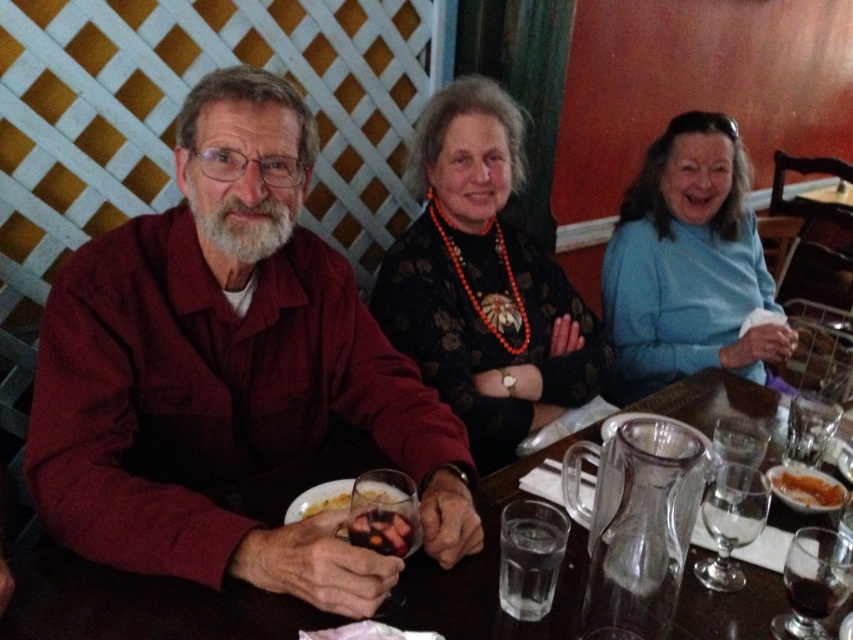
Is black floral dress at center below yellowish matte plate at lower center?

No, black floral dress at center is not below yellowish matte plate at lower center.

Who is positioned more to the left, black floral dress at center or yellowish matte plate at lower center?

Positioned to the left is yellowish matte plate at lower center.

Does point (490, 225) come behind point (320, 500)?

Yes, it is behind point (320, 500).

I want to click on black floral dress at center, so click(x=485, y=282).

Is clear glass pitcher at center behind blue soft sweater at upper right?

No.

Can you confirm if clear glass pitcher at center is shorter than blue soft sweater at upper right?

Correct, clear glass pitcher at center is not as tall as blue soft sweater at upper right.

Where is `clear glass pitcher at center`? The width and height of the screenshot is (853, 640). clear glass pitcher at center is located at coordinates (138, 604).

Find the location of a particular element. clear glass pitcher at center is located at coordinates (138, 604).

Is clear glass pitcher at center to the left of black floral dress at center from the viewer's perspective?

No, clear glass pitcher at center is not to the left of black floral dress at center.

What do you see at coordinates (138, 604) in the screenshot?
I see `clear glass pitcher at center` at bounding box center [138, 604].

Identify the location of clear glass pitcher at center. (138, 604).